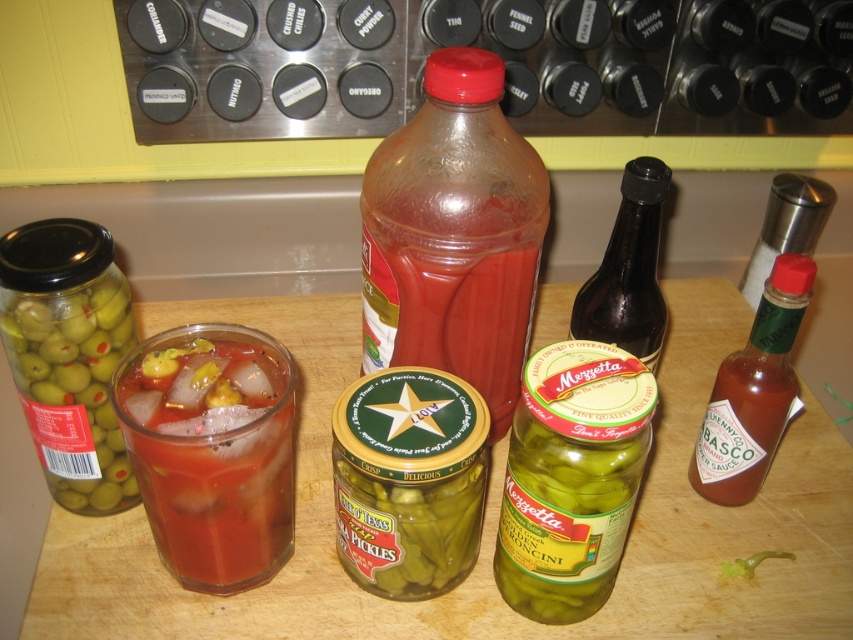
You are a bartender preparing a drink and need to place a 10 cm wide bottle opener on the countertop. You have two options available on the counter, the translucent plastic bottle at center and the translucent glass drink at center. Which object can accommodate the bottle opener without overlapping?

The translucent plastic bottle at center has a larger width than the translucent glass drink at center, so the bottle opener can be placed next to the translucent plastic bottle at center without overlapping since it has more space.

You are a bartender preparing a drink and need to reach for the translucent plastic bottle at center and the translucent glass drink at center. Which one can you grab first without moving your position?

The translucent plastic bottle at center is closer to you than the translucent glass drink at center, so you can grab it first without moving.